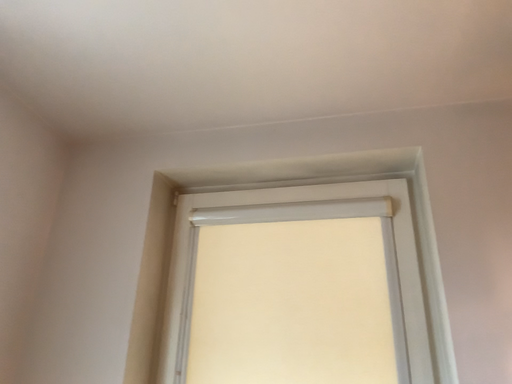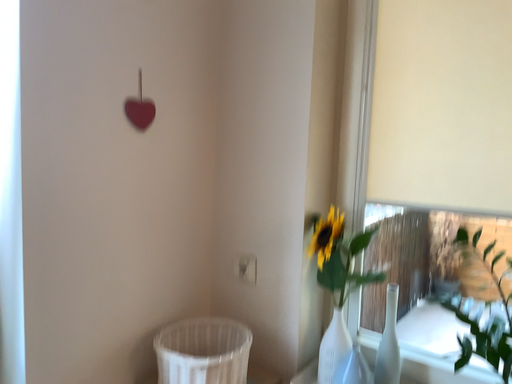
Question: How did the camera likely rotate when shooting the video?

Choices:
 (A) rotated downward
 (B) rotated upward

Answer: (A)